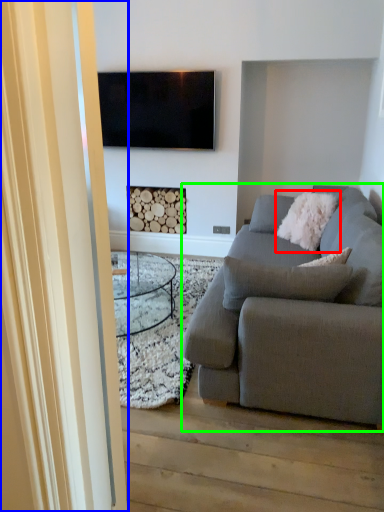
Question: Estimate the real-world distances between objects in this image. Which object is closer to pillow (highlighted by a red box), glass door (highlighted by a blue box) or studio couch (highlighted by a green box)?

Choices:
 (A) glass door
 (B) studio couch

Answer: (B)